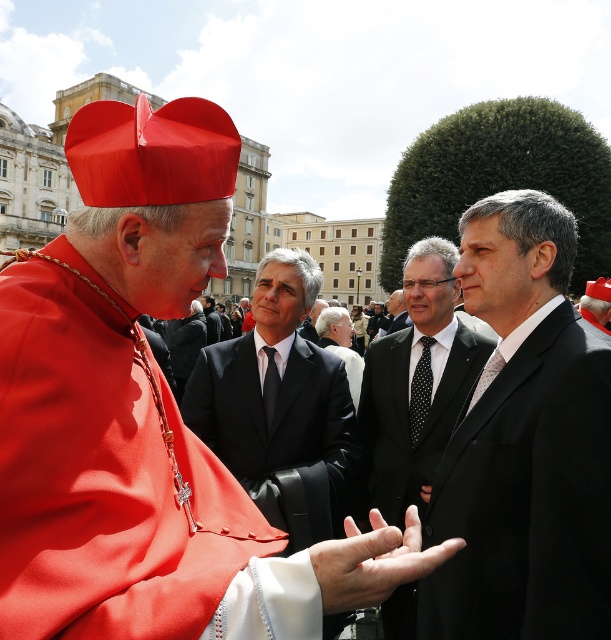
You are a photographer standing at the edge of the gathering. You want to take a photo of the black suit at center and the white matte hand at center. The camera you have can focus on objects within 10 meters. Will both subjects be in focus?

The distance between the black suit at center and the white matte hand at center is 11.90 meters, which exceeds the camera focus range of 10 meters. Therefore, both subjects will not be in focus simultaneously.

You are an artist sketching this scene. You want to ensure the proportions are accurate. Which object, the matte red hat at upper left or the white matte hand at center, should you draw larger in your sketch?

The matte red hat at upper left should be drawn larger in your sketch since it has a greater height compared to the white matte hand at center.

Looking at this image, you are a photographer at this event and want to capture a photo of the dark gray suit at center and the black dotted tie at center. Which one is on the right side when facing the scene?

The black dotted tie at center is positioned on the right side of dark gray suit at center, so when facing the scene, the black dotted tie at center is on the right side of the dark gray suit at center.